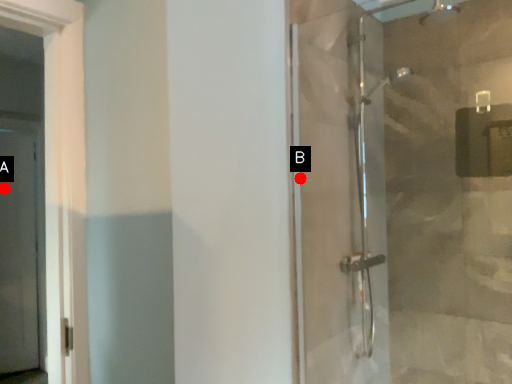
Question: Two points are circled on the image, labeled by A and B beside each circle. Which point is closer to the camera?

Choices:
 (A) A is closer
 (B) B is closer

Answer: (B)